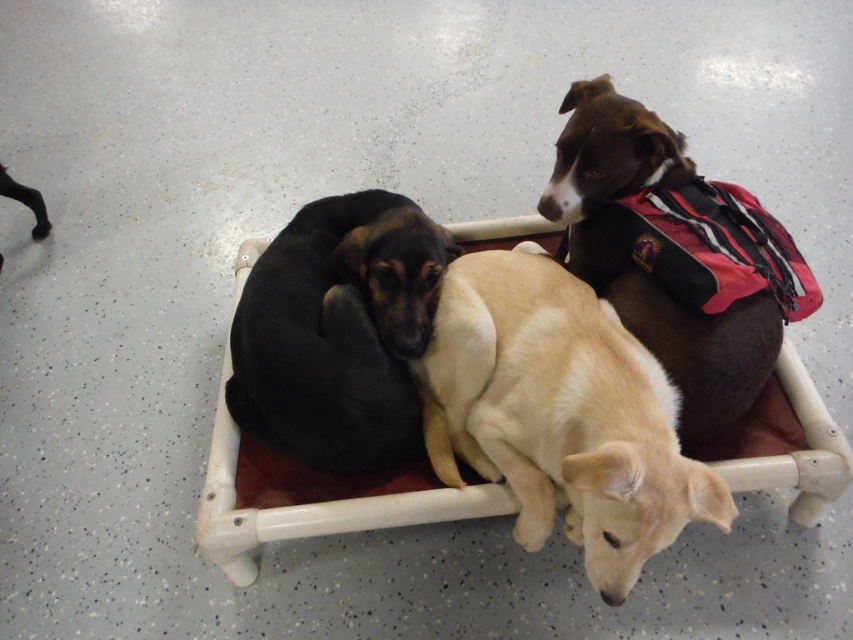
Between white plastic dog bed at center and brownmaterialdog at upper right, which one is positioned lower?

white plastic dog bed at center

Is white plastic dog bed at center positioned before brownmaterialdog at upper right?

Yes, white plastic dog bed at center is in front of brownmaterialdog at upper right.

What do you see at coordinates (311, 499) in the screenshot?
I see `white plastic dog bed at center` at bounding box center [311, 499].

Find the location of a particular element. white plastic dog bed at center is located at coordinates (311, 499).

How distant is black smooth dog at center from white plastic dog bed at center?

The distance of black smooth dog at center from white plastic dog bed at center is 8.83 inches.

Between black smooth dog at center and white plastic dog bed at center, which one has more height?

With more height is white plastic dog bed at center.

What do you see at coordinates (338, 332) in the screenshot?
I see `black smooth dog at center` at bounding box center [338, 332].

Where is `black smooth dog at center`? This screenshot has height=640, width=853. black smooth dog at center is located at coordinates (338, 332).

Is black smooth dog at center smaller than brownmaterialdog at upper right?

Correct, black smooth dog at center occupies less space than brownmaterialdog at upper right.

Is black smooth dog at center in front of brownmaterialdog at upper right?

No, black smooth dog at center is further to the viewer.

Which is behind, point (335, 248) or point (602, 109)?

The point (335, 248) is behind.

The height and width of the screenshot is (640, 853). In order to click on black smooth dog at center in this screenshot , I will do `click(338, 332)`.